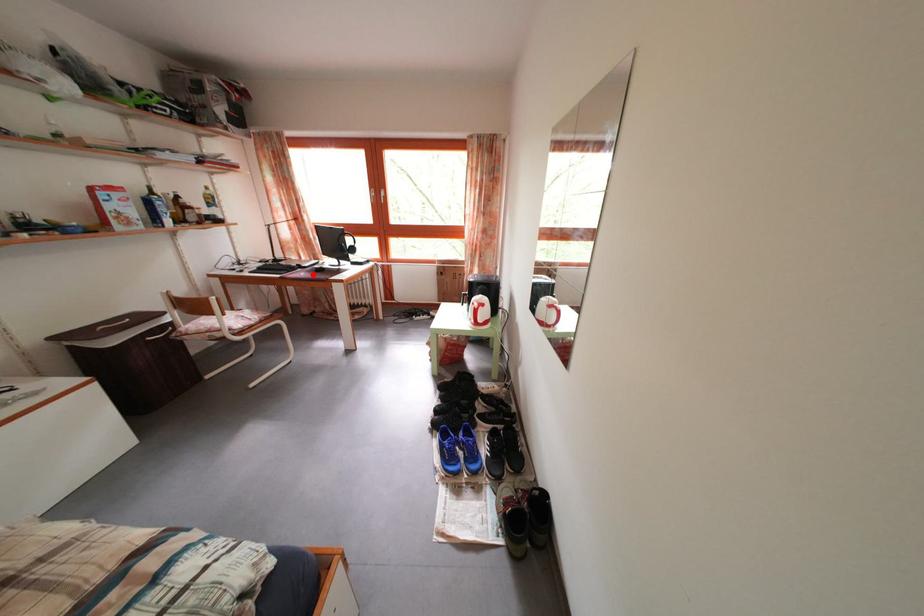
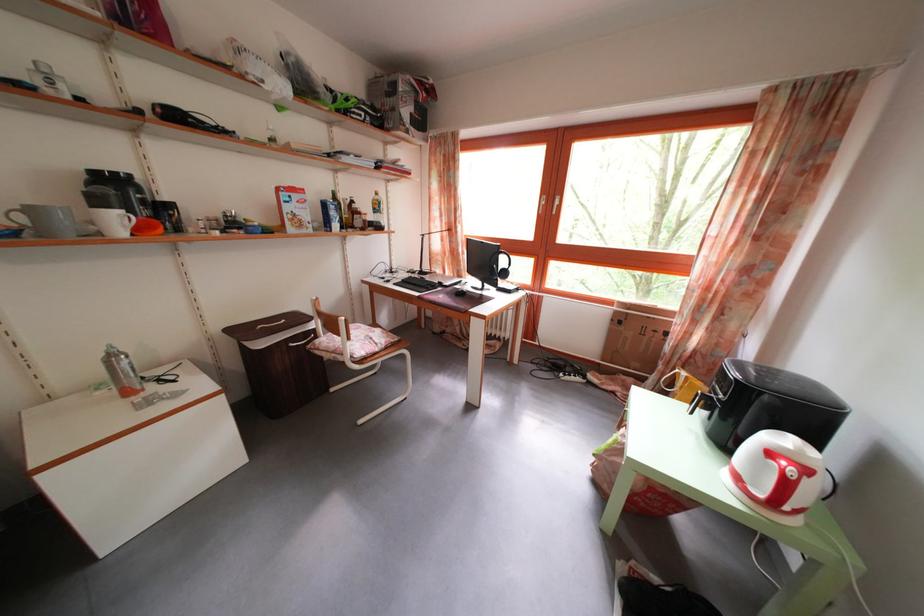
The point at the highlighted location is marked in the first image. Where is the corresponding point in the second image?

(454, 294)